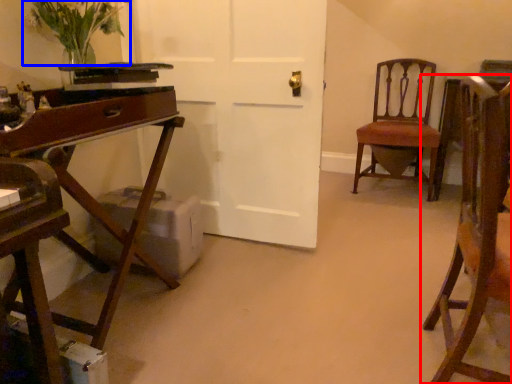
Question: Which object appears farthest to the camera in this image, chair (highlighted by a red box) or floral arrangement (highlighted by a blue box)?

Choices:
 (A) chair
 (B) floral arrangement

Answer: (B)